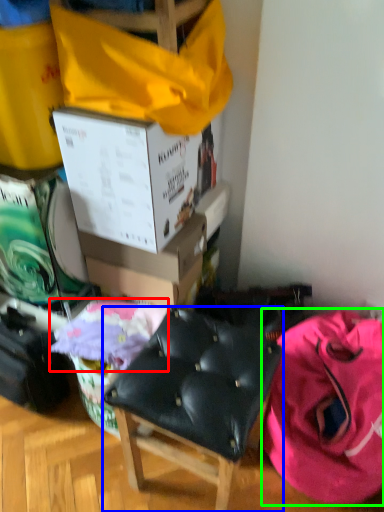
Question: Which object is the closest to the blanket (highlighted by a red box)? Choose among these: chair (highlighted by a blue box) or clothing (highlighted by a green box).

Choices:
 (A) chair
 (B) clothing

Answer: (A)